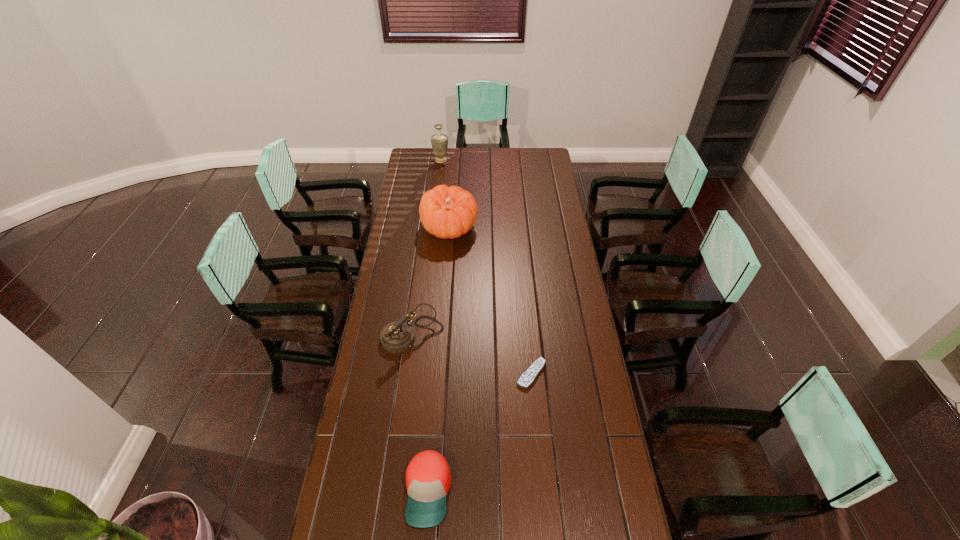
At what (x,y) coordinates should I click in order to perform the action: click on free space that satisfies the following two spatial constraints: 1. on the front side of the shortest object; 2. on the left side of the farthest object. Please return your answer as a coordinate pair (x, y). Looking at the image, I should click on (417, 374).

At what (x,y) coordinates should I click in order to perform the action: click on vacant region that satisfies the following two spatial constraints: 1. on the front side of the second nearest object; 2. on the left side of the third tallest object. Please return your answer as a coordinate pair (x, y). Looking at the image, I should click on (408, 374).

This screenshot has width=960, height=540. In order to click on free space that satisfies the following two spatial constraints: 1. on the front side of the rightmost object; 2. on the left side of the farthest object in this screenshot , I will do `click(417, 374)`.

In order to click on free space that satisfies the following two spatial constraints: 1. on the back side of the pumpkin; 2. on the right side of the third tallest object in this screenshot , I will do `click(427, 228)`.